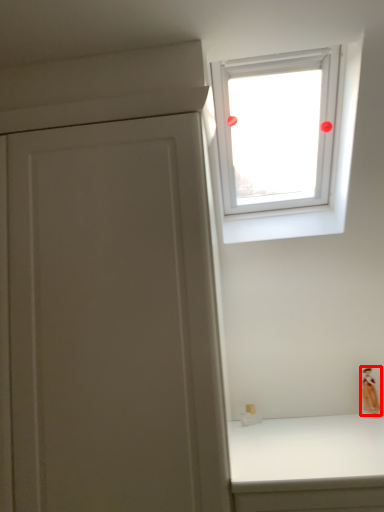
Question: From the image, what is the correct spatial relationship of figurine (annotated by the red box) in relation to window?

Choices:
 (A) left
 (B) right

Answer: (B)